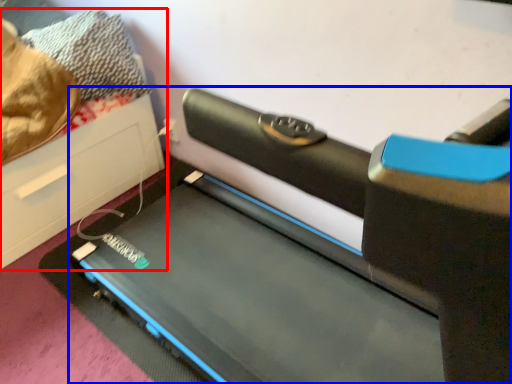
Question: Which object appears farthest to the camera in this image, furniture (highlighted by a red box) or treadmill (highlighted by a blue box)?

Choices:
 (A) furniture
 (B) treadmill

Answer: (A)